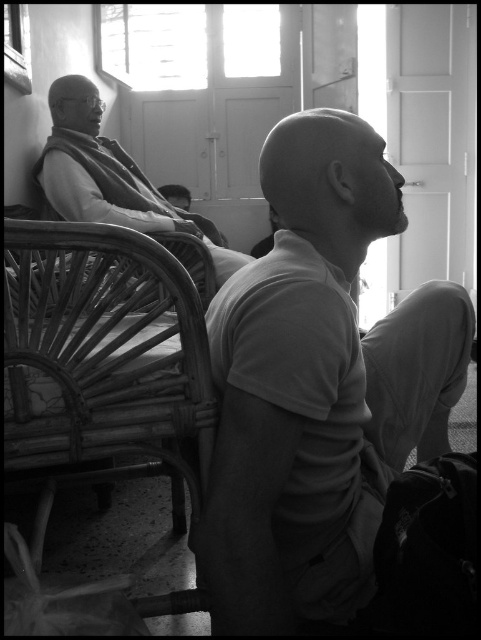
You are a delivery person trying to place a small package between the woven wood chair at left and the matte black robe at left. The package is 12 inches wide. Can you fit it there?

The distance between the woven wood chair at left and the matte black robe at left is 31.53 inches. Since the package is only 12 inches wide, it can easily fit in the space between them.

You are an interior designer assessing the layout of this room. The white cotton shirt at center and the woven wood chair at left are both in the scene. Which object occupies more vertical space in the image?

The white cotton shirt at center is much taller than the woven wood chair at left, so it occupies more vertical space.

You are an interior designer analyzing the seating arrangement in this black and white photo. The woven wood chair at left and the matte black robe at left are both visible. Which object is positioned lower in the image?

The woven wood chair at left is located below matte black robe at left, so the woven wood chair at left is positioned lower in the image.